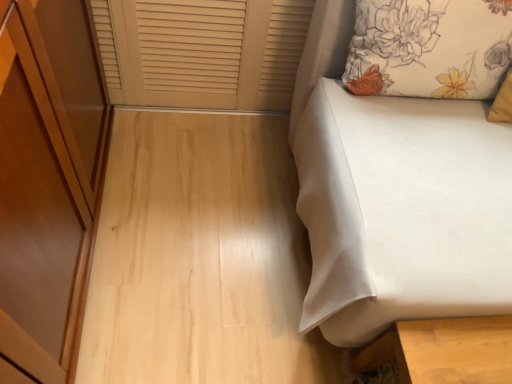
Question: Can you confirm if beige wood window frame at upper left is thinner than floral fabric pillow at upper right?

Choices:
 (A) yes
 (B) no

Answer: (A)

Question: Can you confirm if beige wood window frame at upper left is wider than floral fabric pillow at upper right?

Choices:
 (A) yes
 (B) no

Answer: (B)

Question: From a real-world perspective, does beige wood window frame at upper left sit lower than floral fabric pillow at upper right?

Choices:
 (A) yes
 (B) no

Answer: (A)

Question: Is beige wood window frame at upper left at the right side of floral fabric pillow at upper right?

Choices:
 (A) no
 (B) yes

Answer: (A)

Question: Could you tell me if beige wood window frame at upper left is turned towards floral fabric pillow at upper right?

Choices:
 (A) no
 (B) yes

Answer: (A)

Question: Is beige wood window frame at upper left looking in the opposite direction of floral fabric pillow at upper right?

Choices:
 (A) yes
 (B) no

Answer: (B)

Question: From the image's perspective, is white fabric bed at right on beige wood window frame at upper left?

Choices:
 (A) no
 (B) yes

Answer: (A)

Question: Does white fabric bed at right appear on the left side of beige wood window frame at upper left?

Choices:
 (A) no
 (B) yes

Answer: (A)

Question: Could beige wood window frame at upper left be considered to be inside white fabric bed at right?

Choices:
 (A) no
 (B) yes

Answer: (A)

Question: Can you confirm if white fabric bed at right is thinner than beige wood window frame at upper left?

Choices:
 (A) yes
 (B) no

Answer: (B)

Question: From a real-world perspective, is white fabric bed at right positioned over beige wood window frame at upper left based on gravity?

Choices:
 (A) yes
 (B) no

Answer: (A)

Question: Could you tell me if white fabric bed at right is facing beige wood window frame at upper left?

Choices:
 (A) yes
 (B) no

Answer: (B)

Question: From a real-world perspective, is floral fabric pillow at upper right located higher than white fabric bed at right?

Choices:
 (A) no
 (B) yes

Answer: (B)